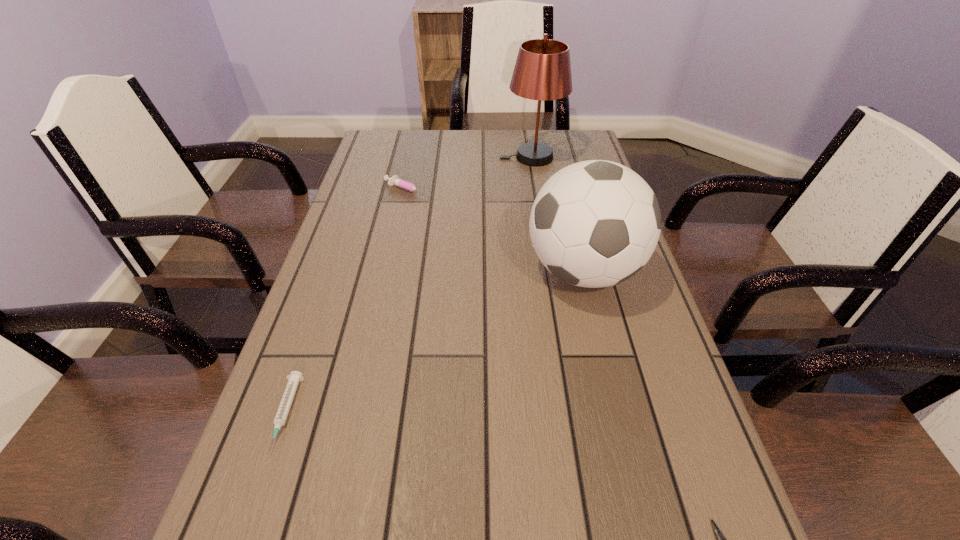
Find the location of a particular element. free space that satisfies the following two spatial constraints: 1. on the front-facing side of the tallest object; 2. on the back side of the fourth shortest object is located at coordinates (550, 271).